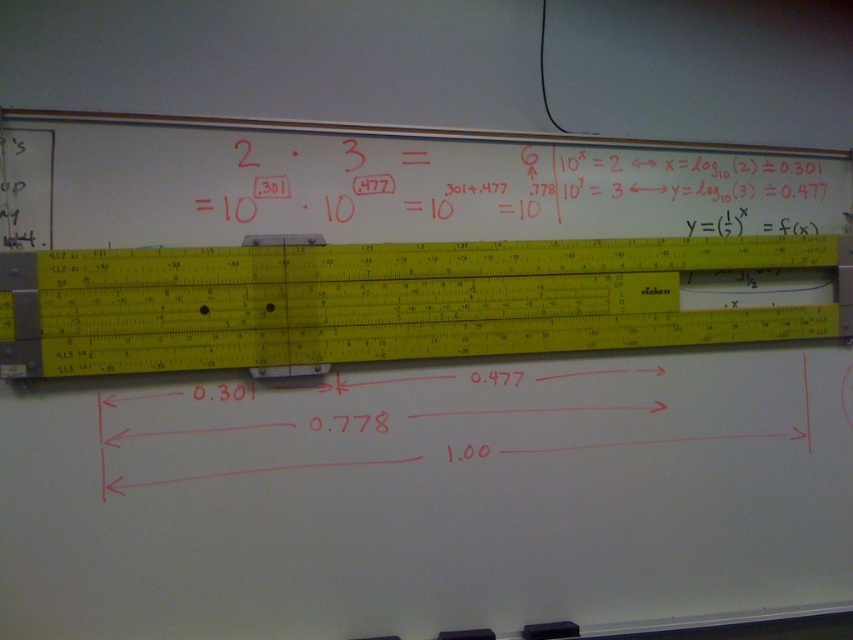
You are standing 5 feet away from the whiteboard. You want to measure the distance between the two equations on the whiteboard using the yellow plastic ruler at center. Can you reach the ruler to do so?

The yellow plastic ruler at center is 5.36 feet away from you, which is slightly farther than your current distance of 5 feet. Therefore, you cannot reach the ruler to measure the equations.

You are a student trying to write on the whiteboard. You need to use the yellow plastic ruler at center and the white chalk math equations at center. Which object should you move first to access the other?

You should move the yellow plastic ruler at center first because it is to the left of the white chalk math equations at center, so moving it allows access to the area where the equations are located.

You are a student trying to write on the whiteboard. You have a yellow plastic ruler at center and white chalk math equations at center in front of you. Which object can you use to draw a straight line?

The yellow plastic ruler at center is larger in size than white chalk math equations at center, so you can use the yellow plastic ruler at center to draw a straight line since rulers are typically used for that purpose.